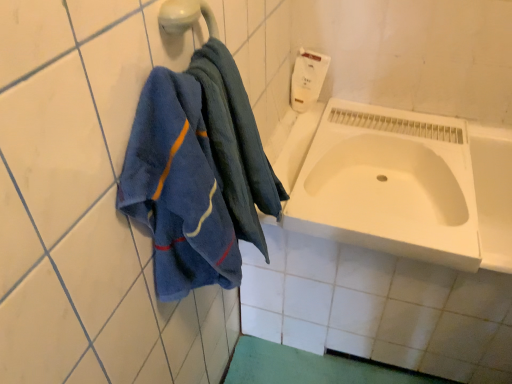
Question: From the image's perspective, is white glossy bathtub at center located beneath blue cotton towel at left?

Choices:
 (A) yes
 (B) no

Answer: (A)

Question: From a real-world perspective, is white glossy bathtub at center located higher than blue cotton towel at left?

Choices:
 (A) no
 (B) yes

Answer: (A)

Question: Would you consider white glossy bathtub at center to be distant from blue cotton towel at left?

Choices:
 (A) yes
 (B) no

Answer: (B)

Question: Is white glossy bathtub at center outside blue cotton towel at left?

Choices:
 (A) no
 (B) yes

Answer: (B)

Question: Is white glossy bathtub at center smaller than blue cotton towel at left?

Choices:
 (A) no
 (B) yes

Answer: (A)

Question: From a real-world perspective, is white glossy bathtub at center below blue cotton towel at left?

Choices:
 (A) yes
 (B) no

Answer: (A)

Question: Is there a large distance between white glossy bathtub at center and white matte sink at lower right?

Choices:
 (A) yes
 (B) no

Answer: (B)

Question: Is the position of white glossy bathtub at center more distant than that of white matte sink at lower right?

Choices:
 (A) yes
 (B) no

Answer: (B)

Question: From the image's perspective, is white glossy bathtub at center under white matte sink at lower right?

Choices:
 (A) no
 (B) yes

Answer: (B)

Question: From the image's perspective, does white glossy bathtub at center appear higher than white matte sink at lower right?

Choices:
 (A) no
 (B) yes

Answer: (A)

Question: Is white glossy bathtub at center taller than white matte sink at lower right?

Choices:
 (A) yes
 (B) no

Answer: (A)

Question: Is white matte sink at lower right located within white glossy bathtub at center?

Choices:
 (A) no
 (B) yes

Answer: (B)

Question: Is white matte soap dispenser at upper right wider than white glossy bathtub at center?

Choices:
 (A) no
 (B) yes

Answer: (A)